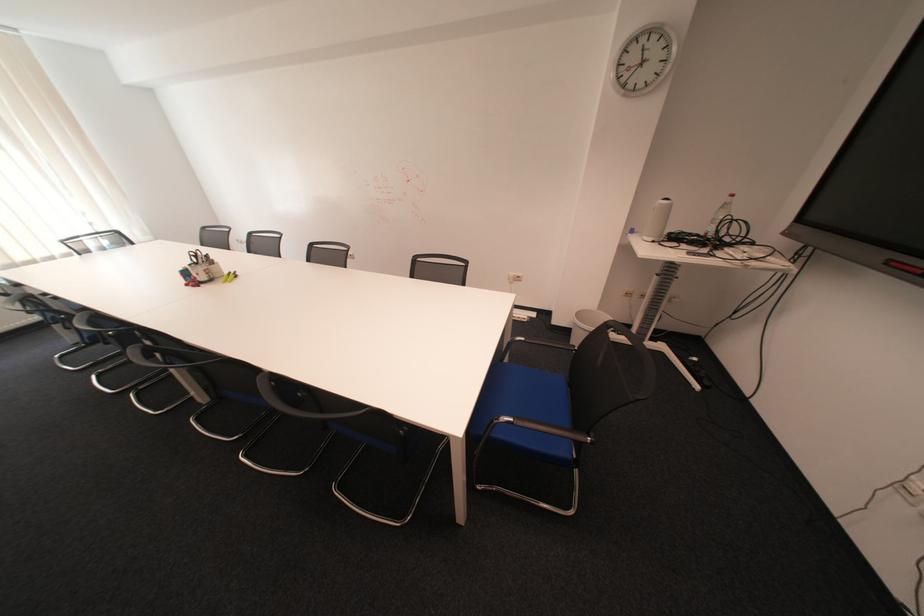
Identify the location of white water flask. The image size is (924, 616). (658, 220).